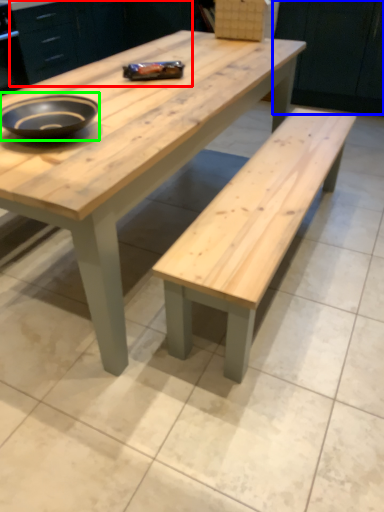
Question: Which object is positioned closest to cabinetry (highlighted by a red box)? Select from cabinetry (highlighted by a blue box) and bowl (highlighted by a green box).

Choices:
 (A) cabinetry
 (B) bowl

Answer: (A)